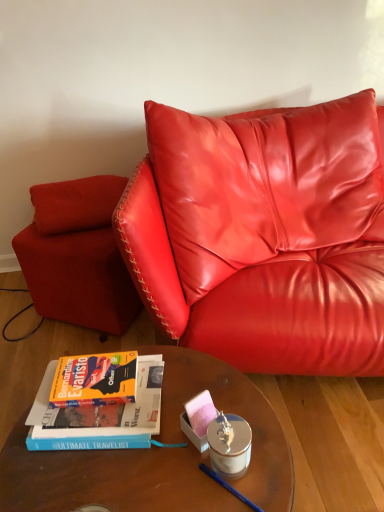
In order to click on vacant point above wooden glass table at center (from a real-world perspective) in this screenshot , I will do `click(163, 436)`.